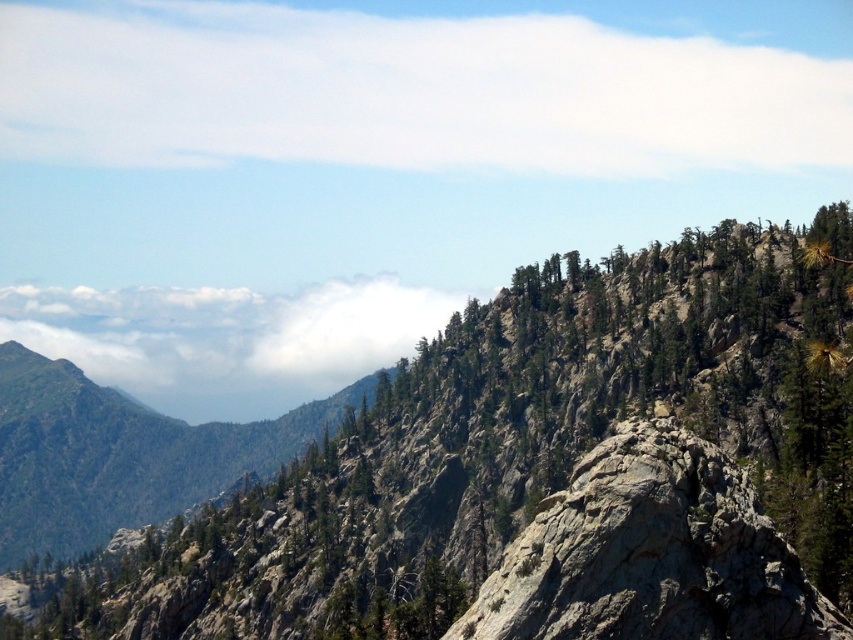
Does green textured tree at upper center have a smaller size compared to white fluffy cloud at upper left?

Incorrect, green textured tree at upper center is not smaller in size than white fluffy cloud at upper left.

Is point (775, 417) in front of point (196, 332)?

Yes, point (775, 417) is closer to viewer.

Is point (621, 308) closer to viewer compared to point (444, 300)?

Yes, it is in front of point (444, 300).

Where is `green textured tree at upper center`? green textured tree at upper center is located at coordinates (479, 467).

Does green textured tree at upper center have a smaller size compared to gray rough rock at center-right?

No.

Between point (764, 292) and point (706, 509), which one is positioned in front?

Point (706, 509)

Locate an element on the screen. The height and width of the screenshot is (640, 853). green textured tree at upper center is located at coordinates (479, 467).

Can you confirm if white fluffy cloud at upper center is positioned to the left of white fluffy cloud at upper left?

No, white fluffy cloud at upper center is not to the left of white fluffy cloud at upper left.

Measure the distance between point (701, 115) and camera.

2276.45 feet

Does point (305, 154) lie in front of point (44, 296)?

Yes, point (305, 154) is closer to viewer.

This screenshot has height=640, width=853. What are the coordinates of `white fluffy cloud at upper center` in the screenshot? It's located at (404, 92).